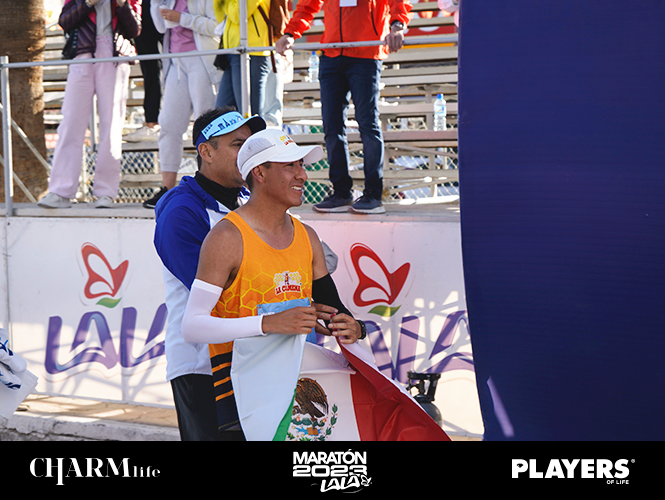
Where is `bottle`? The width and height of the screenshot is (665, 500). bottle is located at coordinates (438, 110), (312, 70).